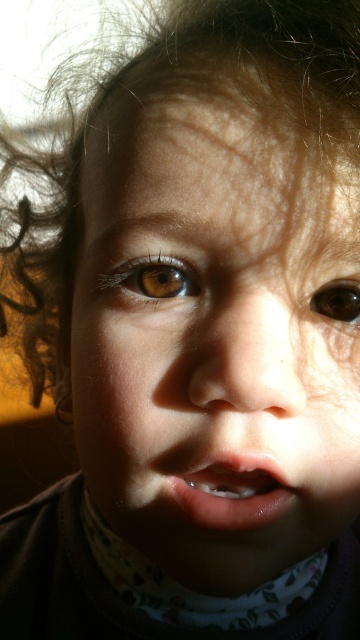
Between point (204, 472) and point (164, 291), which one is positioned behind?

Point (164, 291)

Is pink glossy lips at center taller than brown matte eye at upper left?

Indeed, pink glossy lips at center has a greater height compared to brown matte eye at upper left.

What do you see at coordinates (231, 490) in the screenshot?
I see `pink glossy lips at center` at bounding box center [231, 490].

Find the location of a particular element. pink glossy lips at center is located at coordinates (231, 490).

Does smooth skin face at center have a smaller size compared to dark curly hair at upper left?

Yes.

Is smooth skin face at center bigger than dark curly hair at upper left?

No.

Between point (227, 336) and point (285, 8), which one is positioned behind?

Point (285, 8)

The image size is (360, 640). In order to click on smooth skin face at center in this screenshot , I will do `click(217, 326)`.

Measure the distance from brown matte eye at upper left to brown glossy eye at center.

They are 6.09 centimeters apart.

Who is shorter, brown matte eye at upper left or brown glossy eye at center?

brown glossy eye at center

The height and width of the screenshot is (640, 360). I want to click on brown matte eye at upper left, so click(x=153, y=276).

Where is `brown matte eye at upper left`? This screenshot has height=640, width=360. brown matte eye at upper left is located at coordinates (153, 276).